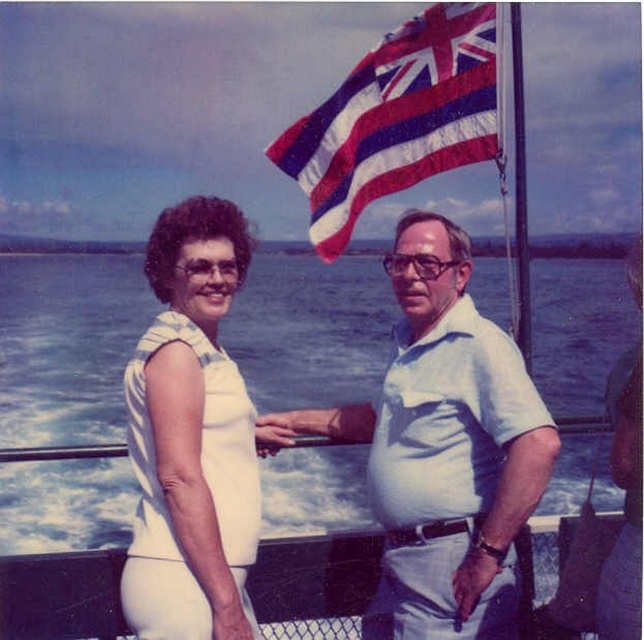
Question: In this image, where is white fabric dress at left located relative to textured fabric flag at upper center?

Choices:
 (A) right
 (B) left

Answer: (B)

Question: Among these objects, which one is farthest from the camera?

Choices:
 (A) textured fabric flag at upper center
 (B) white fabric dress at left

Answer: (A)

Question: Does white cotton shirt at center come in front of white fabric dress at left?

Choices:
 (A) no
 (B) yes

Answer: (A)

Question: Is the position of blue water at center more distant than that of white cotton shirt at center?

Choices:
 (A) yes
 (B) no

Answer: (B)

Question: Considering the real-world distances, which object is farthest from the textured fabric flag at upper center?

Choices:
 (A) blue water at center
 (B) white fabric dress at left
 (C) white cotton shirt at center

Answer: (A)

Question: Which point is closer to the camera?

Choices:
 (A) (337, 248)
 (B) (77, 387)
 (C) (187, 596)

Answer: (C)